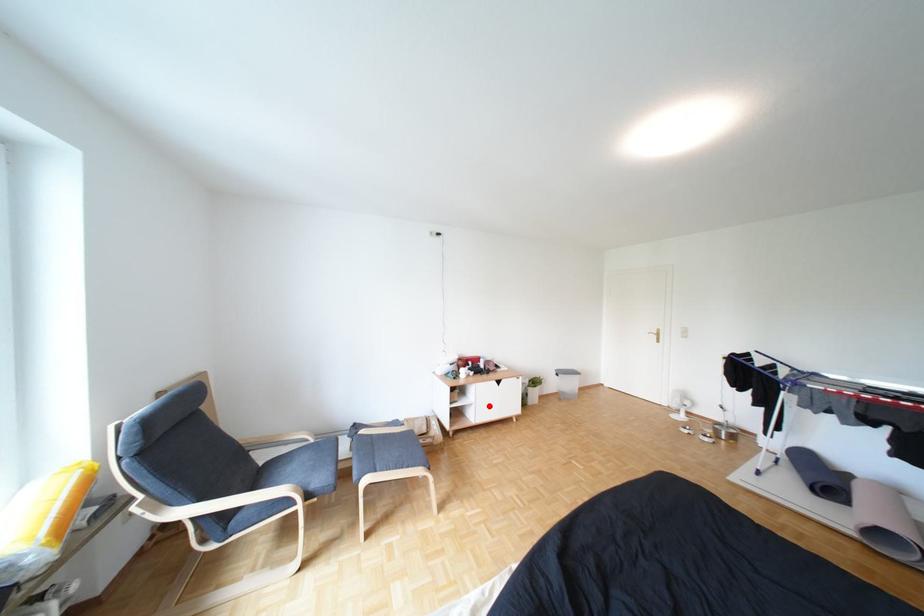
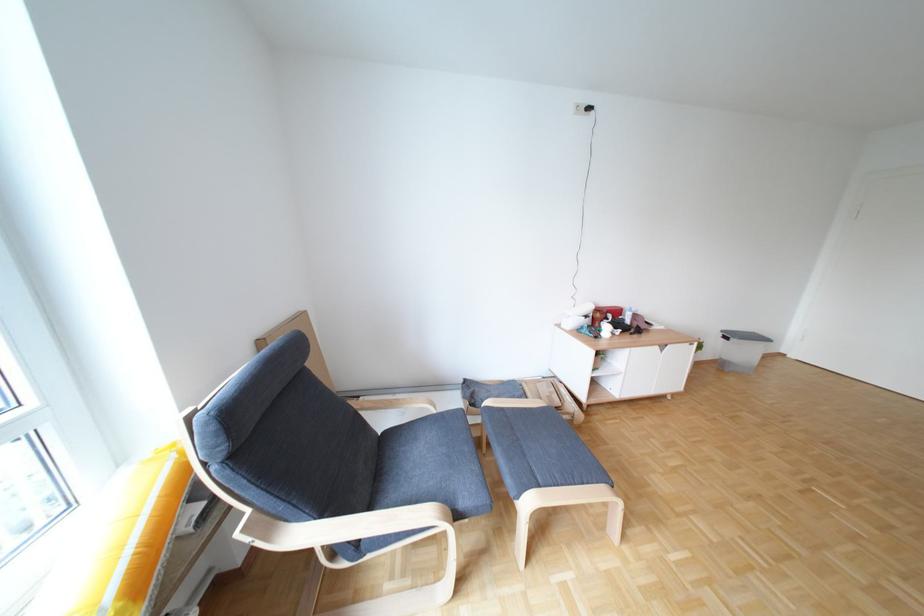
Question: I am providing you with two images of the same scene from different viewpoints. In image1, a red point is highlighted. Considering the same 3D point in image2, which of the following is correct?

Choices:
 (A) It is closer
 (B) It is farther

Answer: (A)